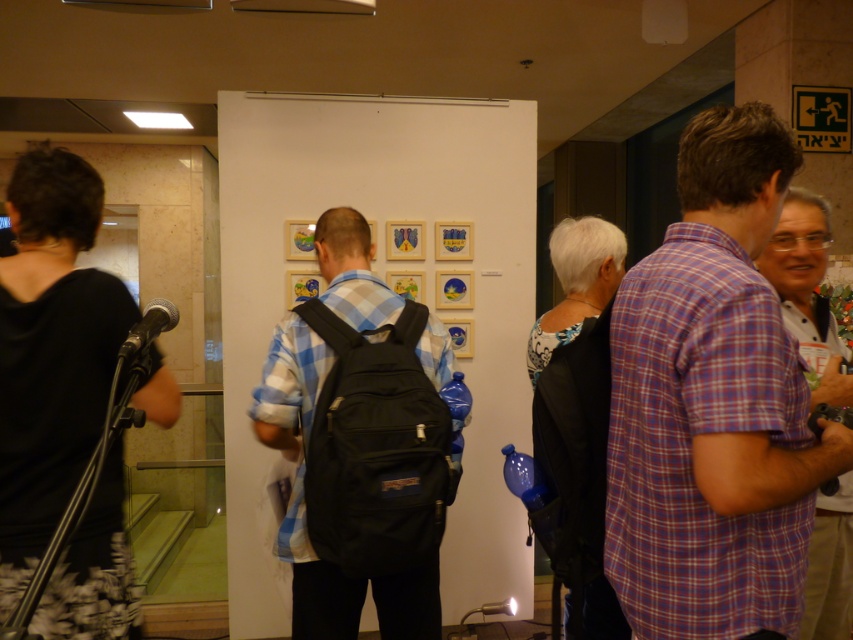
Question: Based on their relative distances, which object is nearer to the purple plaid shirt at right?

Choices:
 (A) black fabric backpack at center
 (B) plaid cotton shirt at right

Answer: (B)

Question: Does purple plaid shirt at right have a larger size compared to plaid cotton shirt at right?

Choices:
 (A) no
 (B) yes

Answer: (A)

Question: Among these points, which one is nearest to the camera?

Choices:
 (A) (663, 262)
 (B) (384, 381)
 (C) (811, 362)

Answer: (A)

Question: Is purple plaid shirt at right below black fabric backpack at center?

Choices:
 (A) no
 (B) yes

Answer: (A)

Question: Which point is farther to the camera?

Choices:
 (A) plaid cotton shirt at right
 (B) black fabric backpack at center

Answer: (B)

Question: Does purple plaid shirt at right appear over black fabric backpack at center?

Choices:
 (A) yes
 (B) no

Answer: (A)